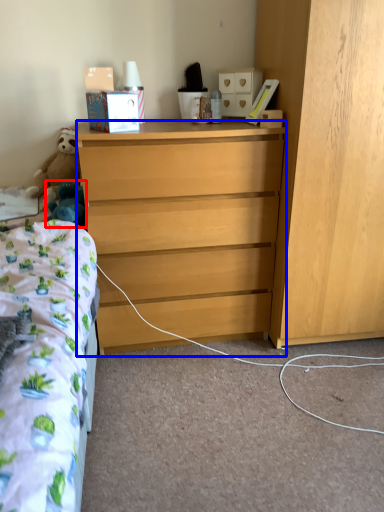
Question: Which point is closer to the camera, toy (highlighted by a red box) or desk (highlighted by a blue box)?

Choices:
 (A) toy
 (B) desk

Answer: (B)